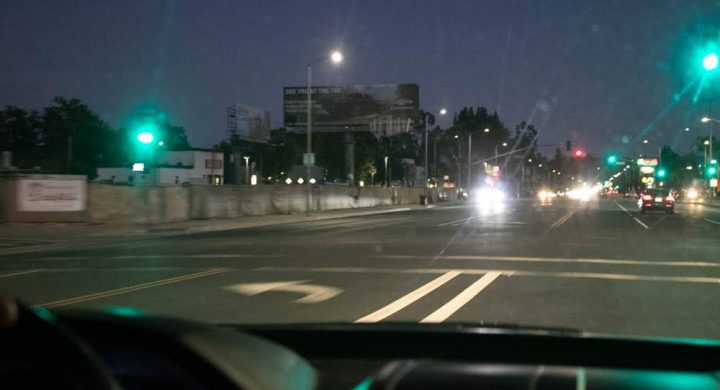
Where is `light`? Image resolution: width=720 pixels, height=390 pixels. light is located at coordinates (145, 137).